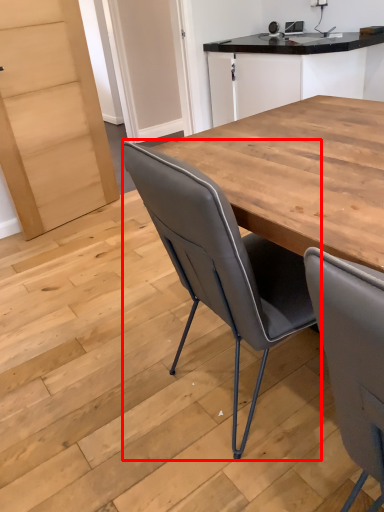
Question: Considering the relative positions of chair (annotated by the red box) and cabinetry in the image provided, where is chair (annotated by the red box) located with respect to the staircase?

Choices:
 (A) left
 (B) right

Answer: (A)